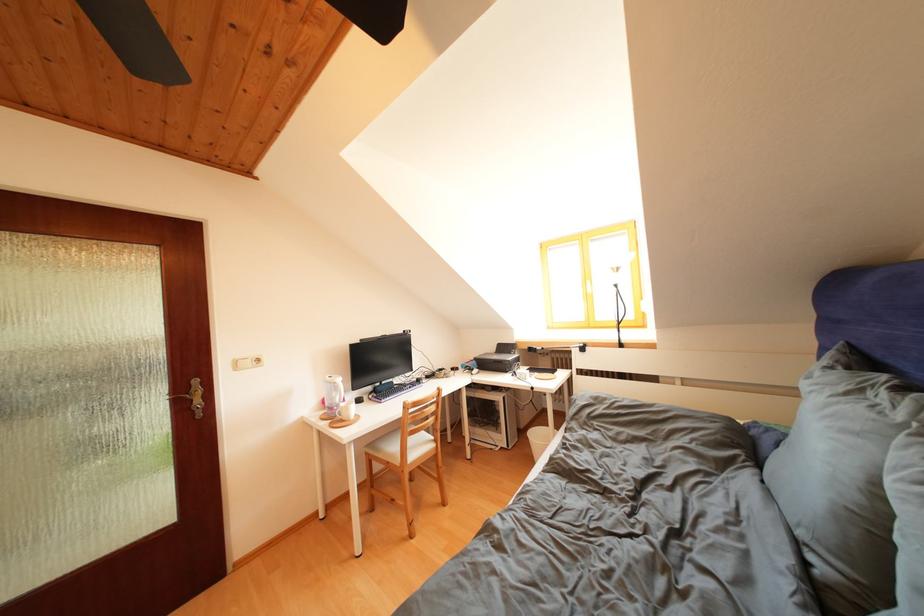
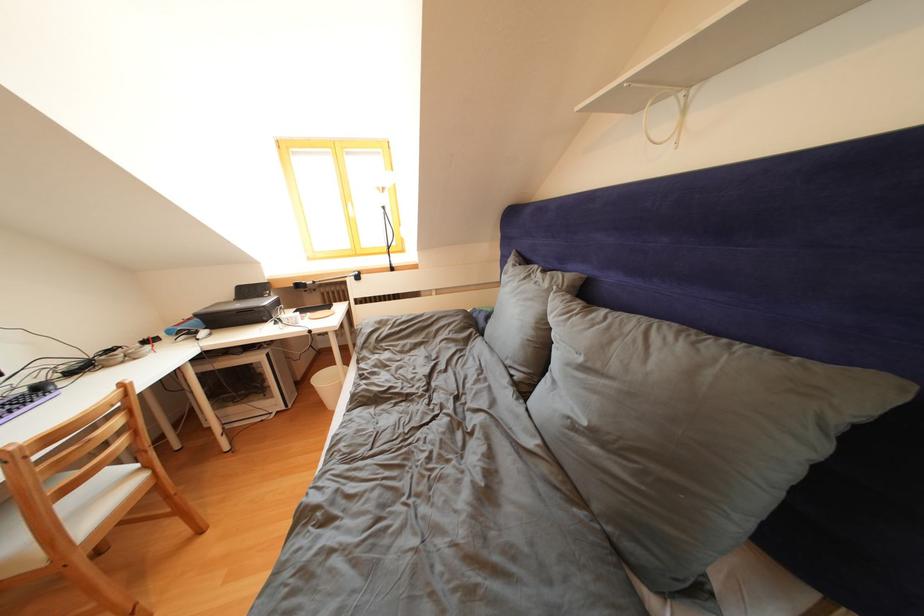
How did the camera likely rotate?

The camera rotated toward right-down.